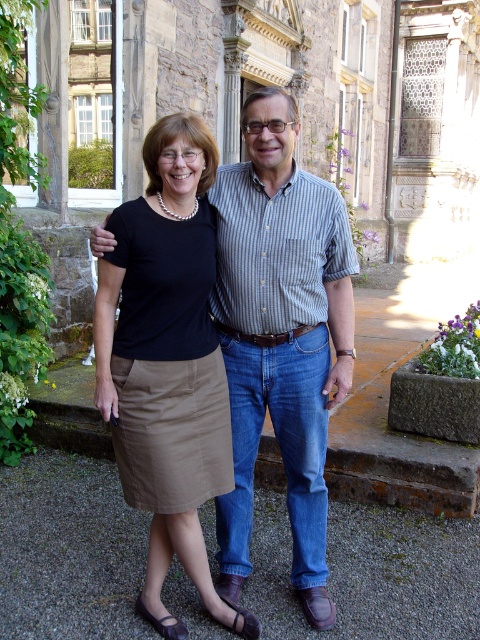
You are a fashion designer observing two items in the image. The striped cotton shirt at center and the matte khaki skirt at center. Which item is positioned higher on the person?

The striped cotton shirt at center is positioned higher than the matte khaki skirt at center.

You are a photographer setting up for a group photo. You need to ensure that the striped cotton shirt at center and the matte khaki skirt at center are both visible in the frame. Given their heights, which one might you need to adjust the camera angle to focus on first?

The striped cotton shirt at center is taller than the matte khaki skirt at center, so you should focus on the striped cotton shirt at center first to ensure it is properly framed before adjusting for the shorter matte khaki skirt at center.